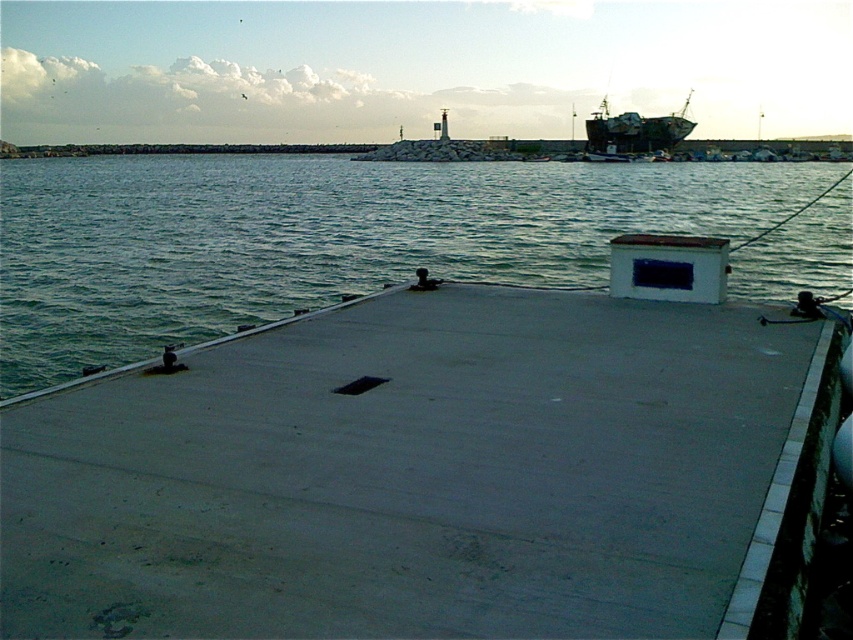
Question: Which point is closer to the camera?

Choices:
 (A) gray concrete dock at center
 (B) metallic gray ship at upper right

Answer: (A)

Question: Is gray concrete dock at center below greenish water at center?

Choices:
 (A) yes
 (B) no

Answer: (A)

Question: Is gray concrete dock at center thinner than metallic gray ship at upper right?

Choices:
 (A) yes
 (B) no

Answer: (A)

Question: Which object is farther from the camera taking this photo?

Choices:
 (A) gray concrete dock at center
 (B) metallic gray ship at upper right

Answer: (B)

Question: Does gray concrete dock at center appear on the left side of greenish water at center?

Choices:
 (A) no
 (B) yes

Answer: (B)

Question: Which is farther from the metallic gray ship at upper right?

Choices:
 (A) greenish water at center
 (B) gray concrete dock at center

Answer: (B)